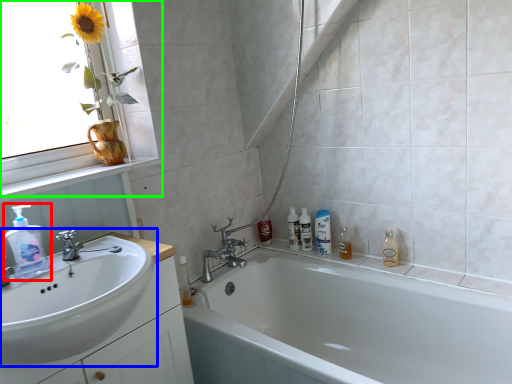
Question: Estimate the real-world distances between objects in this image. Which object is farther from cleaning product (highlighted by a red box), sink (highlighted by a blue box) or window (highlighted by a green box)?

Choices:
 (A) sink
 (B) window

Answer: (B)